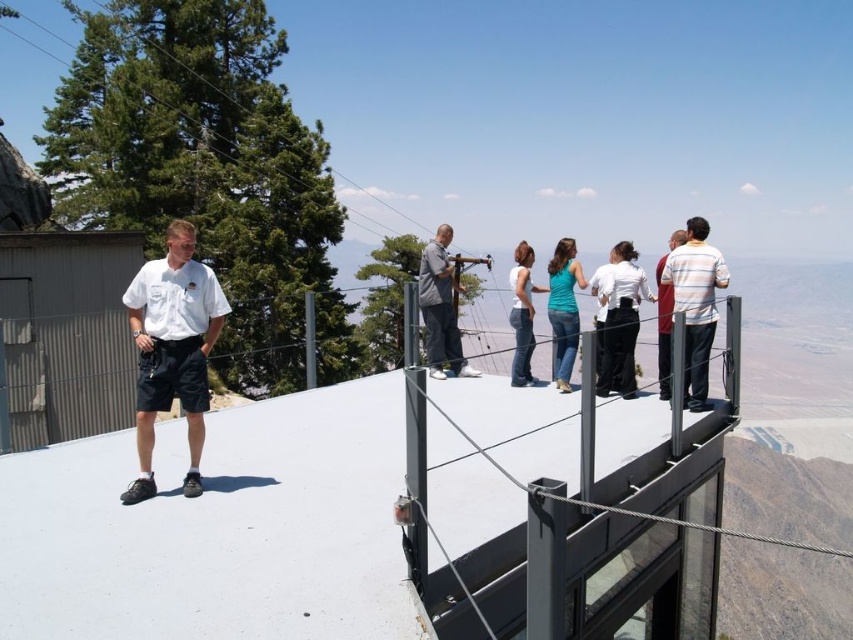
Question: Can you confirm if striped cotton shirt at right is wider than white cotton tank top at center?

Choices:
 (A) no
 (B) yes

Answer: (A)

Question: Among these objects, which one is farthest from the camera?

Choices:
 (A) white cotton tank top at center
 (B) gray fabric jacket at center
 (C) striped shirt at center
 (D) striped cotton shirt at right

Answer: (A)

Question: From the image, what is the correct spatial relationship of white cotton tank top at center in relation to striped shirt at center?

Choices:
 (A) left
 (B) right

Answer: (A)

Question: Which point is farther to the camera?

Choices:
 (A) white cotton tank top at center
 (B) striped cotton shirt at right
 (C) gray fabric jacket at center

Answer: (A)

Question: Among these objects, which one is nearest to the camera?

Choices:
 (A) white matte shirt at center
 (B) white cotton tank top at center
 (C) matte teal shirt at center

Answer: (A)

Question: Is white matte shirt at center to the left of matte teal shirt at center from the viewer's perspective?

Choices:
 (A) no
 (B) yes

Answer: (A)